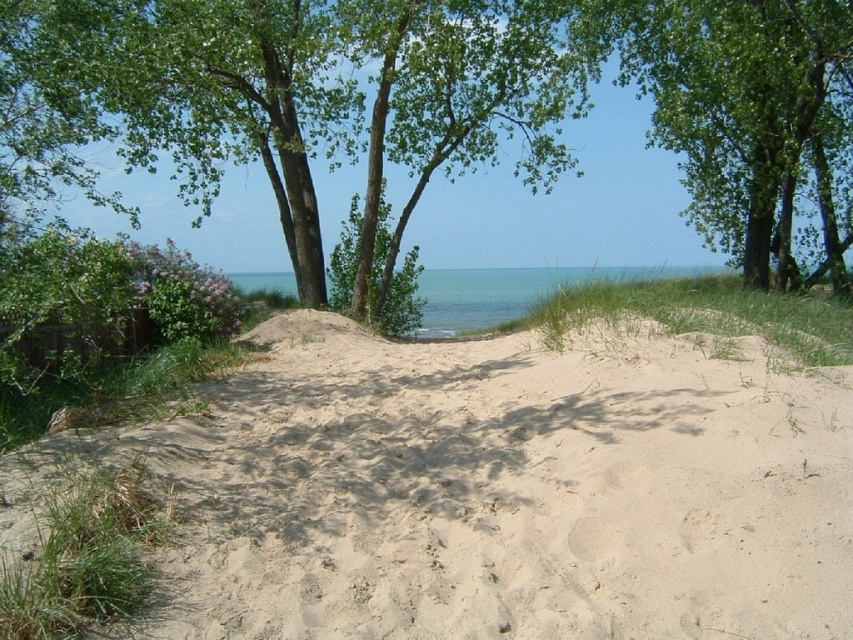
You are standing at the sandy dune in the foreground and want to walk towards the green leafy tree at upper right. Which direction should you walk to avoid the green leafy tree at center?

Walk to the right of the green leafy tree at center to reach the green leafy tree at upper right since the green leafy tree at center is to the left of the green leafy tree at upper right.

You are planning to build a small sandcastle on the light beige sand at center. Considering the space available, will you have enough room compared to the blue water at center?

The light beige sand at center occupies less space than the blue water at center, so there might not be enough room to build a large sandcastle compared to the area covered by the blue water at center.

You are standing on the light beige sand at center and want to reach the blue water at center. Which direction should you move to get there?

The light beige sand at center is positioned under the blue water at center, so you should move forward or upward to reach the blue water at center.